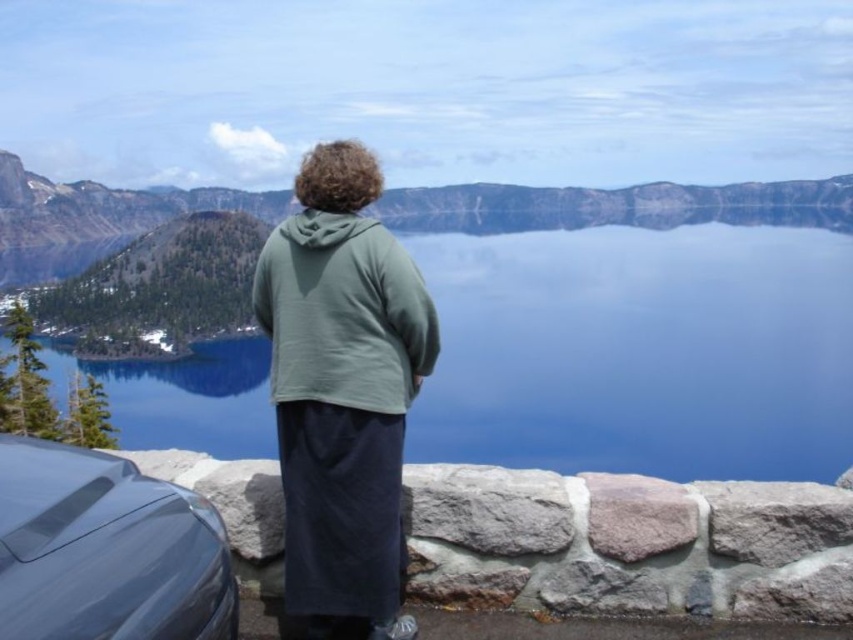
Between green matte hoodie at center and glossy metallic car at lower left, which one has more height?

Standing taller between the two is green matte hoodie at center.

Between point (280, 337) and point (204, 637), which one is positioned behind?

The point (280, 337) is behind.

The width and height of the screenshot is (853, 640). I want to click on green matte hoodie at center, so click(341, 390).

You are a GUI agent. You are given a task and a screenshot of the screen. Output one action in this format:
    pyautogui.click(x=<x>, y=<y>)
    Task: Click on the blue glassy water at center
    This screenshot has width=853, height=640.
    Given the screenshot: What is the action you would take?
    point(640,340)

Who is shorter, blue glassy water at center or glossy metallic car at lower left?

glossy metallic car at lower left is shorter.

This screenshot has height=640, width=853. What do you see at coordinates (640, 340) in the screenshot?
I see `blue glassy water at center` at bounding box center [640, 340].

Identify the location of blue glassy water at center. (640, 340).

Locate an element on the screen. The image size is (853, 640). blue glassy water at center is located at coordinates (640, 340).

Does blue glassy water at center have a lesser height compared to green matte hoodie at center?

Incorrect, blue glassy water at center's height does not fall short of green matte hoodie at center's.

Measure the distance between blue glassy water at center and camera.

They are 75.13 feet apart.

You are a GUI agent. You are given a task and a screenshot of the screen. Output one action in this format:
    pyautogui.click(x=<x>, y=<y>)
    Task: Click on the blue glassy water at center
    The height and width of the screenshot is (640, 853).
    Given the screenshot: What is the action you would take?
    pyautogui.click(x=640, y=340)